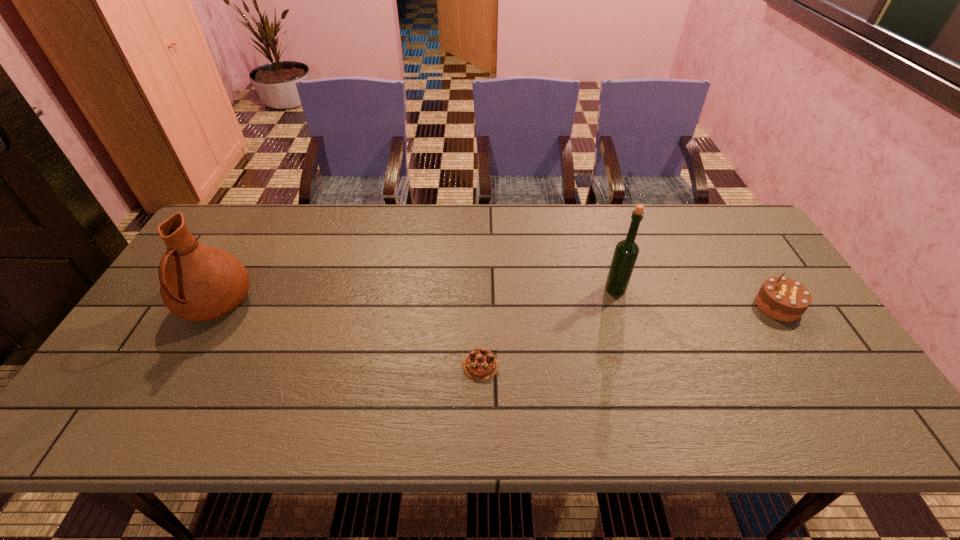
Where is `free space that satisfies the following two spatial constraints: 1. on the back side of the liquor; 2. on the right side of the left chocolate cake`? free space that satisfies the following two spatial constraints: 1. on the back side of the liquor; 2. on the right side of the left chocolate cake is located at coordinates (480, 289).

This screenshot has height=540, width=960. Identify the location of free location that satisfies the following two spatial constraints: 1. on the side of the nearest object with the handle; 2. on the right side of the pitcher. (181, 366).